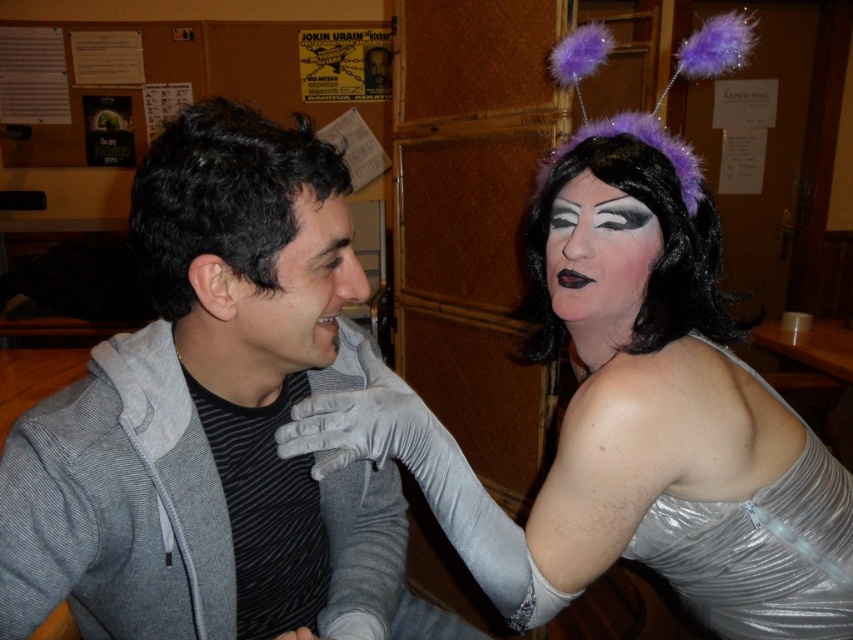
Who is higher up, gray hoodie at left or matte gray hoodie at center?

matte gray hoodie at center is higher up.

Is point (212, 339) behind point (331, 252)?

Yes.

Find the location of `gray hoodie at left`. gray hoodie at left is located at coordinates (213, 420).

Can you confirm if shiny silver dress at center is positioned to the left of matte gray hoodie at center?

In fact, shiny silver dress at center is to the right of matte gray hoodie at center.

Looking at this image, is shiny silver dress at center taller than matte gray hoodie at center?

Yes, shiny silver dress at center is taller than matte gray hoodie at center.

Is point (770, 392) farther from viewer compared to point (265, 326)?

Yes.

You are a GUI agent. You are given a task and a screenshot of the screen. Output one action in this format:
    pyautogui.click(x=<x>, y=<y>)
    Task: Click on the shiny silver dress at center
    The width and height of the screenshot is (853, 640).
    Given the screenshot: What is the action you would take?
    pyautogui.click(x=628, y=426)

Can you confirm if shiny silver dress at center is taller than matte silver face at upper right?

Correct, shiny silver dress at center is much taller as matte silver face at upper right.

Which is below, shiny silver dress at center or matte silver face at upper right?

shiny silver dress at center

Locate an element on the screen. This screenshot has width=853, height=640. shiny silver dress at center is located at coordinates (628, 426).